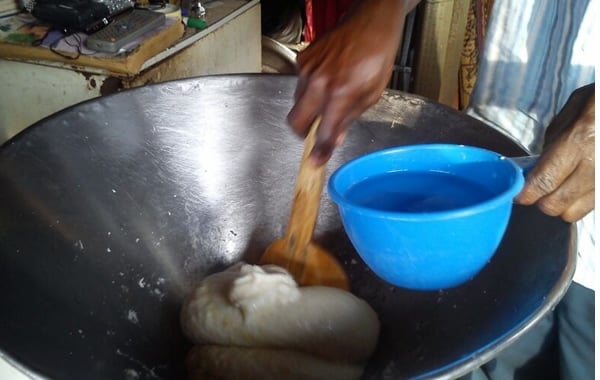
In order to click on nasty white side of table in this screenshot , I will do `click(39, 92)`.